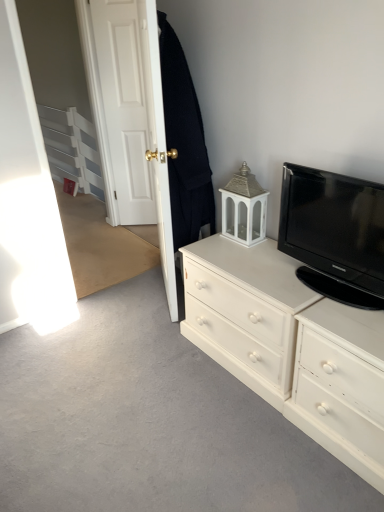
The image size is (384, 512). Find the location of `free space to the left of white painted wood chest of drawers at right`. free space to the left of white painted wood chest of drawers at right is located at coordinates 151,366.